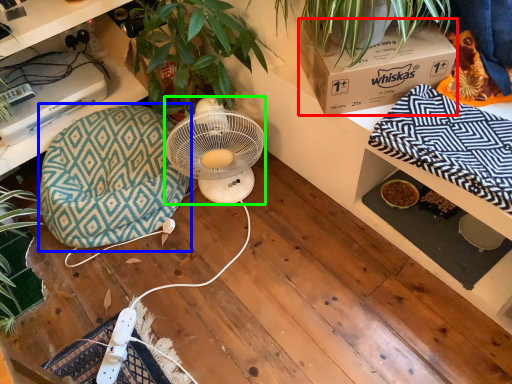
Question: Based on their relative distances, which object is farther from box (highlighted by a red box)? Choose from bean bag chair (highlighted by a blue box) and mechanical fan (highlighted by a green box).

Choices:
 (A) bean bag chair
 (B) mechanical fan

Answer: (A)